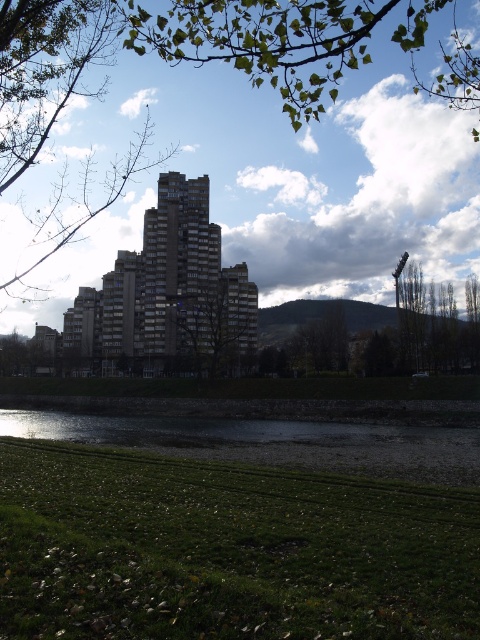
Can you confirm if green grassy bank at lower center is thinner than green leafy tree at right?

No.

Which of these two, green grassy bank at lower center or green leafy tree at right, stands taller?

green leafy tree at right

Between point (327, 435) and point (470, 282), which one is positioned behind?

The point (470, 282) is more distant.

The image size is (480, 640). Find the location of `green grassy bank at lower center`. green grassy bank at lower center is located at coordinates (273, 442).

Is green grass at lower center taller than green leafy tree at right?

Incorrect, green grass at lower center's height is not larger of green leafy tree at right's.

Who is more forward, [335,532] or [400,291]?

Positioned in front is point [335,532].

Where is `green grass at lower center`? green grass at lower center is located at coordinates (227, 548).

Who is more distant from viewer, [406,352] or [248,328]?

Positioned behind is point [248,328].

Does green leafy tree at right appear on the right side of green leafy tree at center?

Yes, green leafy tree at right is to the right of green leafy tree at center.

This screenshot has width=480, height=640. What do you see at coordinates (434, 321) in the screenshot? I see `green leafy tree at right` at bounding box center [434, 321].

Where is `green leafy tree at right`? Image resolution: width=480 pixels, height=640 pixels. green leafy tree at right is located at coordinates [x=434, y=321].